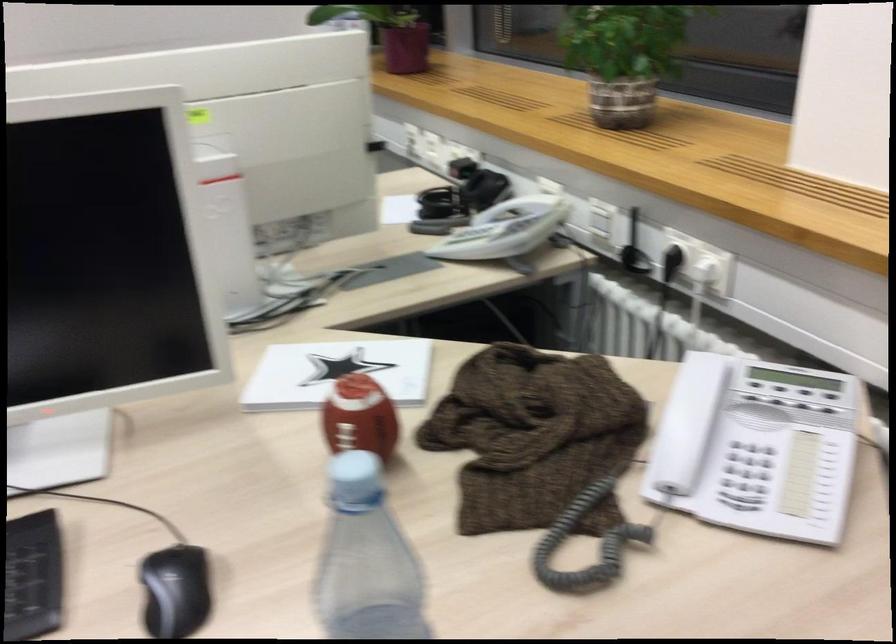
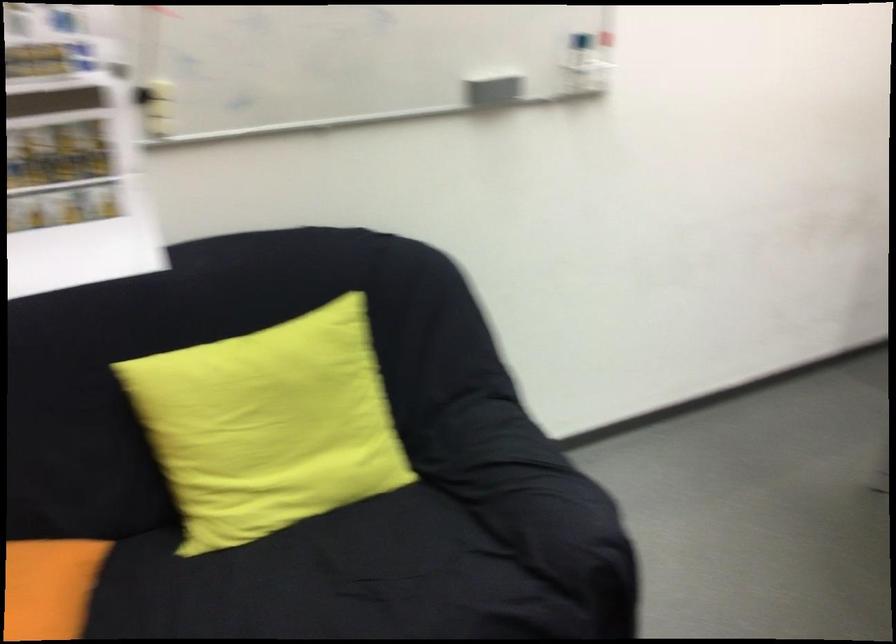
Question: Which direction would the cameraman need to move to produce the second image? Reply with the corresponding letter.

Choices:
 (A) Left
 (B) Right
 (C) Forward
 (D) Backward

Answer: (A)